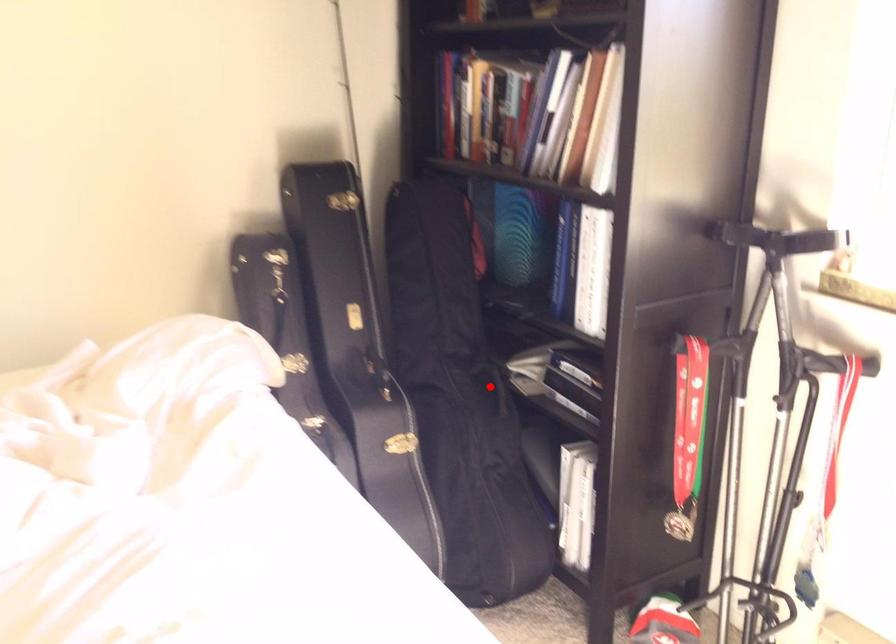
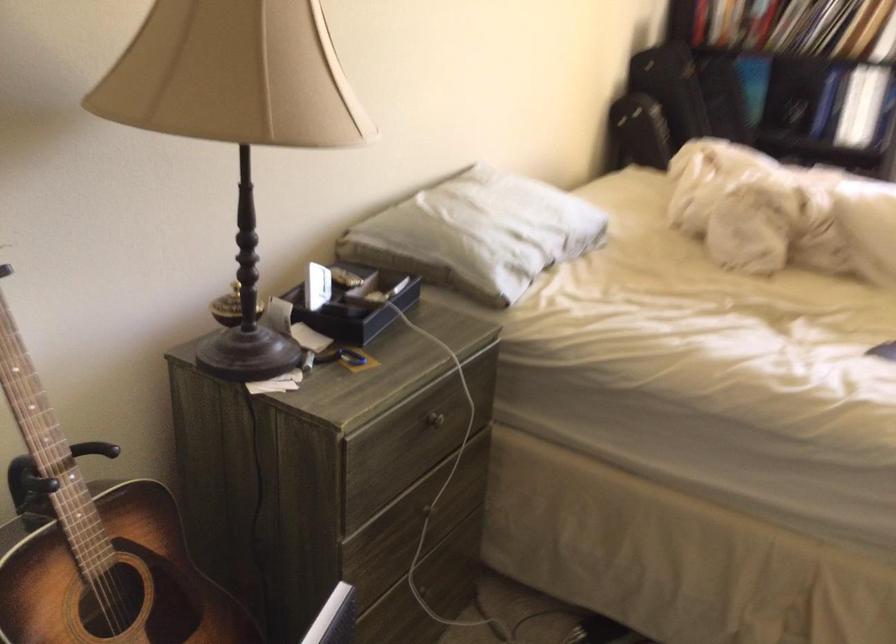
Question: I am providing you with two images of the same scene from different viewpoints. A red point is marked on the first image. Can you still see the location of the red point in image 2?

Choices:
 (A) Yes
 (B) No

Answer: (B)